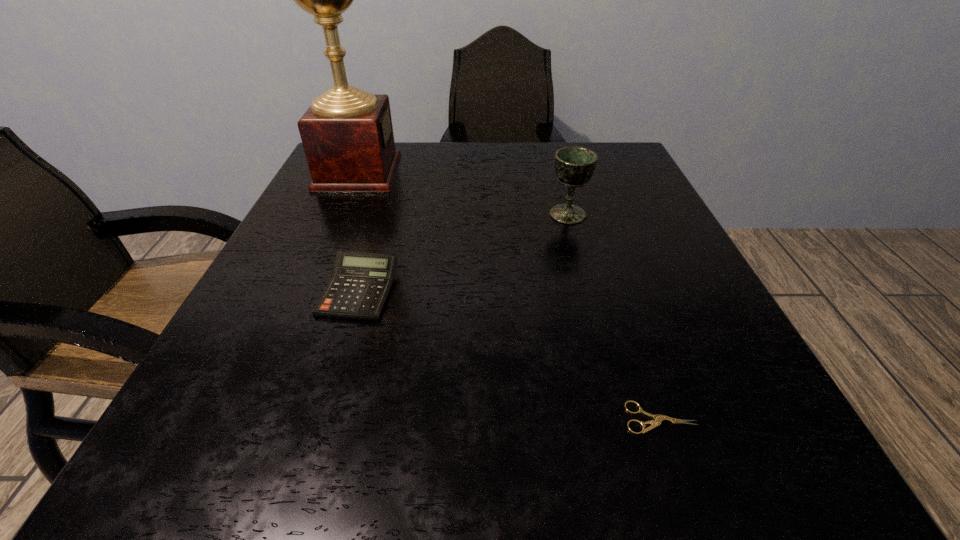
Image resolution: width=960 pixels, height=540 pixels. I want to click on free region at the left edge of the desktop, so click(220, 341).

At what (x,y) coordinates should I click in order to perform the action: click on free space at the right edge of the desktop. Please return your answer as a coordinate pair (x, y). The height and width of the screenshot is (540, 960). Looking at the image, I should click on (704, 408).

The image size is (960, 540). What are the coordinates of `blank space at the far right corner of the desktop` in the screenshot? It's located at (634, 157).

At what (x,y) coordinates should I click in order to perform the action: click on vacant space in between the shortest object and the second nearest object. Please return your answer as a coordinate pair (x, y). The width and height of the screenshot is (960, 540). Looking at the image, I should click on (510, 354).

Where is `empty location between the trophy cup and the calculator`? Image resolution: width=960 pixels, height=540 pixels. empty location between the trophy cup and the calculator is located at coordinates (358, 231).

This screenshot has width=960, height=540. I want to click on vacant area that lies between the nearest object and the trophy cup, so click(x=509, y=295).

Image resolution: width=960 pixels, height=540 pixels. What are the coordinates of `free space between the shears and the trophy cup` in the screenshot? It's located at (509, 295).

This screenshot has height=540, width=960. In order to click on blank region between the third shortest object and the nearest object in this screenshot , I will do `click(613, 316)`.

At what (x,y) coordinates should I click in order to perform the action: click on free space between the calculator and the third shortest object. Please return your answer as a coordinate pair (x, y). This screenshot has height=540, width=960. Looking at the image, I should click on (464, 253).

The image size is (960, 540). I want to click on free space between the chalice and the calculator, so click(x=464, y=253).